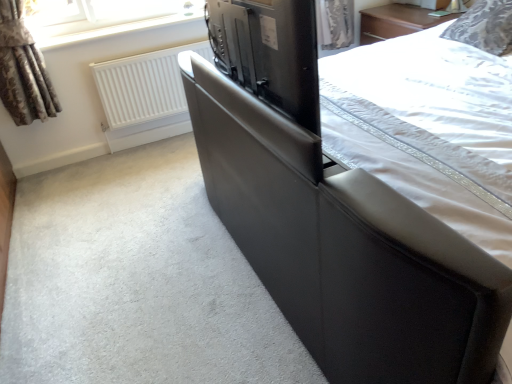
Locate an element on the screen. patterned fabric pillow at upper right is located at coordinates (484, 27).

In order to face patterned fabric pillow at upper right, should I rotate leftwards or rightwards?

To align with it, rotate right about 28.954°.

In the scene shown: In order to face black leather bed at center, should I rotate leftwards or rightwards?

Turn right approximately 28.534 degrees to face it.

What do you see at coordinates (23, 70) in the screenshot? The width and height of the screenshot is (512, 384). I see `brown textured curtain at upper left` at bounding box center [23, 70].

Locate an element on the screen. patterned fabric pillow at upper right is located at coordinates (484, 27).

What's the angular difference between matte black tv at center and black leather bed at center's facing directions?

180 degrees separate the facing orientations of matte black tv at center and black leather bed at center.

You are a GUI agent. You are given a task and a screenshot of the screen. Output one action in this format:
    pyautogui.click(x=<x>, y=<y>)
    Task: Click on the appliance lying below the black leather bed at center (from the image's perspective)
    This screenshot has width=512, height=384.
    Given the screenshot: What is the action you would take?
    pyautogui.click(x=269, y=52)

Considering the relative sizes of matte black tv at center and black leather bed at center in the image provided, is matte black tv at center taller than black leather bed at center?

In fact, matte black tv at center may be shorter than black leather bed at center.

From a real-world perspective, is matte black tv at center above or below black leather bed at center?

matte black tv at center is situated higher than black leather bed at center in the real world.

From the image's perspective, which is below, brown textured curtain at upper left or patterned fabric pillow at upper right?

brown textured curtain at upper left.

From a real-world perspective, is brown textured curtain at upper left positioned above or below patterned fabric pillow at upper right?

brown textured curtain at upper left is above patterned fabric pillow at upper right.

Which point is more distant from viewer, (39, 71) or (470, 28)?

Positioned behind is point (39, 71).

What's the angular difference between brown textured curtain at upper left and patterned fabric pillow at upper right's facing directions?

The angle between the facing direction of brown textured curtain at upper left and the facing direction of patterned fabric pillow at upper right is 87.4 degrees.

Is white matte radiator at upper left touching matte black tv at center?

white matte radiator at upper left and matte black tv at center are clearly separated.

Is matte black tv at center inside white matte radiator at upper left?

That's incorrect, matte black tv at center is not inside white matte radiator at upper left.

Is white matte radiator at upper left bigger or smaller than matte black tv at center?

Clearly, white matte radiator at upper left is larger in size than matte black tv at center.

From a real-world perspective, does white matte radiator at upper left sit lower than matte black tv at center?

Yes.

Would you say patterned fabric pillow at upper right is to the left or to the right of black leather bed at center in the picture?

Clearly, patterned fabric pillow at upper right is on the right of black leather bed at center in the image.

Which of these two, patterned fabric pillow at upper right or black leather bed at center, stands shorter?

Standing shorter between the two is patterned fabric pillow at upper right.

Identify the location of pillow behind the black leather bed at center. (484, 27).

Between patterned fabric pillow at upper right and black leather bed at center, which one has smaller width?

patterned fabric pillow at upper right.

What's the angular difference between white matte radiator at upper left and brown textured curtain at upper left's facing directions?

The angular difference between white matte radiator at upper left and brown textured curtain at upper left is 0.402 degrees.

Looking at this image, from a real-world perspective, is white matte radiator at upper left under brown textured curtain at upper left?

Yes, from a real-world perspective, white matte radiator at upper left is under brown textured curtain at upper left.

Looking at their sizes, would you say white matte radiator at upper left is wider or thinner than brown textured curtain at upper left?

white matte radiator at upper left is thinner than brown textured curtain at upper left.

Is white matte radiator at upper left turned away from brown textured curtain at upper left?

No, white matte radiator at upper left is not facing away from brown textured curtain at upper left.

Considering the sizes of objects white matte radiator at upper left and black leather bed at center in the image provided, who is shorter, white matte radiator at upper left or black leather bed at center?

white matte radiator at upper left.

Is white matte radiator at upper left oriented towards black leather bed at center?

Yes, white matte radiator at upper left is oriented towards black leather bed at center.

Does white matte radiator at upper left appear on the right side of black leather bed at center?

No.

Looking at the image, does white matte radiator at upper left seem bigger or smaller compared to black leather bed at center?

In the image, white matte radiator at upper left appears to be smaller than black leather bed at center.

Considering the relative positions of brown textured curtain at upper left and black leather bed at center in the image provided, is brown textured curtain at upper left behind black leather bed at center?

That is True.

Is brown textured curtain at upper left with black leather bed at center?

No, brown textured curtain at upper left is not in contact with black leather bed at center.

Is brown textured curtain at upper left facing towards black leather bed at center?

No, brown textured curtain at upper left is not aimed at black leather bed at center.

Identify the location of bed in front of the matte black tv at center. (332, 216).

Where is `curtain behind the patterned fabric pillow at upper right`? The image size is (512, 384). curtain behind the patterned fabric pillow at upper right is located at coordinates (23, 70).

Looking at the image, which one is located further to white matte radiator at upper left, matte black tv at center or brown textured curtain at upper left?

The object further to white matte radiator at upper left is matte black tv at center.

Based on their spatial positions, is brown textured curtain at upper left or white matte radiator at upper left further from matte black tv at center?

Among the two, brown textured curtain at upper left is located further to matte black tv at center.

Considering their positions, is brown textured curtain at upper left positioned further to patterned fabric pillow at upper right than black leather bed at center?

brown textured curtain at upper left is positioned further to the anchor patterned fabric pillow at upper right.

From the image, which object appears to be farther from brown textured curtain at upper left, matte black tv at center or white matte radiator at upper left?

matte black tv at center lies further to brown textured curtain at upper left than the other object.

Looking at the image, which one is located closer to white matte radiator at upper left, brown textured curtain at upper left or matte black tv at center?

brown textured curtain at upper left lies closer to white matte radiator at upper left than the other object.

Estimate the real-world distances between objects in this image. Which object is closer to black leather bed at center, brown textured curtain at upper left or patterned fabric pillow at upper right?

patterned fabric pillow at upper right.

When comparing their distances from matte black tv at center, does brown textured curtain at upper left or black leather bed at center seem closer?

black leather bed at center is positioned closer to the anchor matte black tv at center.

Estimate the real-world distances between objects in this image. Which object is further from brown textured curtain at upper left, black leather bed at center or patterned fabric pillow at upper right?

patterned fabric pillow at upper right is positioned further to the anchor brown textured curtain at upper left.

What are the coordinates of `curtain between black leather bed at center and white matte radiator at upper left in the front-back direction` in the screenshot? It's located at (23, 70).

You are a GUI agent. You are given a task and a screenshot of the screen. Output one action in this format:
    pyautogui.click(x=<x>, y=<y>)
    Task: Click on the appliance located between black leather bed at center and patterned fabric pillow at upper right in the depth direction
    The image size is (512, 384).
    Given the screenshot: What is the action you would take?
    pyautogui.click(x=269, y=52)

Where is `radiator between brown textured curtain at upper left and patterned fabric pillow at upper right`? The image size is (512, 384). radiator between brown textured curtain at upper left and patterned fabric pillow at upper right is located at coordinates (144, 86).

Locate an element on the screen. This screenshot has width=512, height=384. pillow located between black leather bed at center and white matte radiator at upper left in the depth direction is located at coordinates (484, 27).